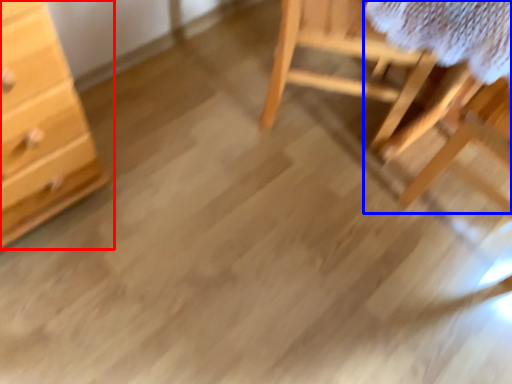
Question: Which object appears farthest to the camera in this image, chest of drawers (highlighted by a red box) or table (highlighted by a blue box)?

Choices:
 (A) chest of drawers
 (B) table

Answer: (B)